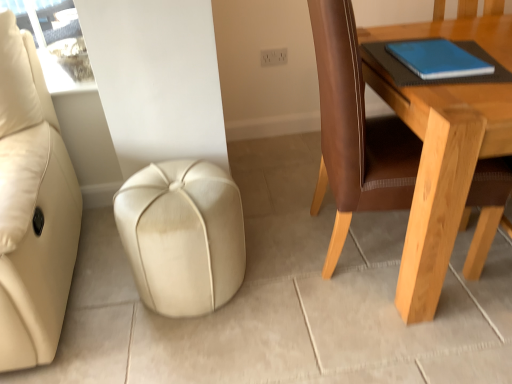
You are a GUI agent. You are given a task and a screenshot of the screen. Output one action in this format:
    pyautogui.click(x=<x>, y=<y>)
    Task: Click on the free space above beige leather ottoman at center (from a real-world perspective)
    The height and width of the screenshot is (384, 512).
    Given the screenshot: What is the action you would take?
    pyautogui.click(x=166, y=187)